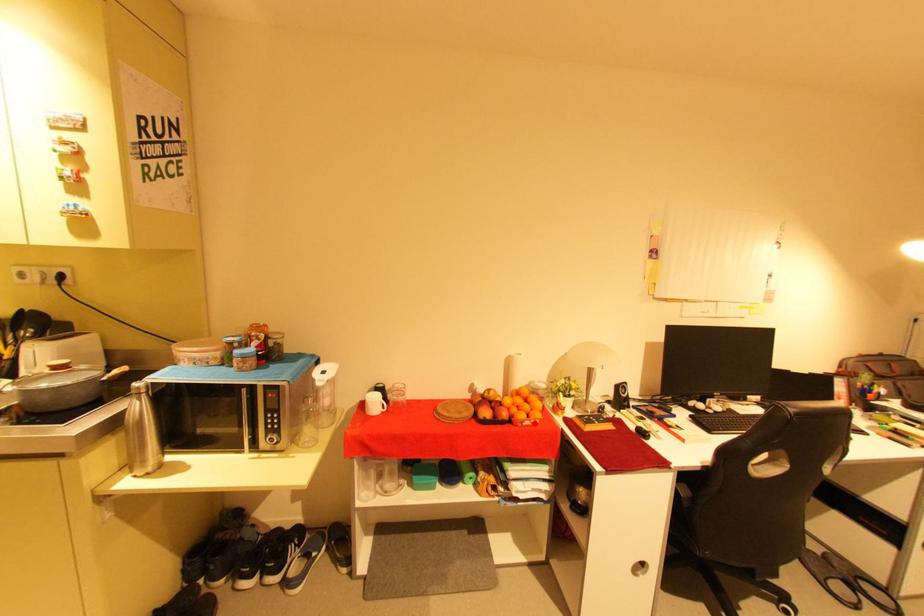
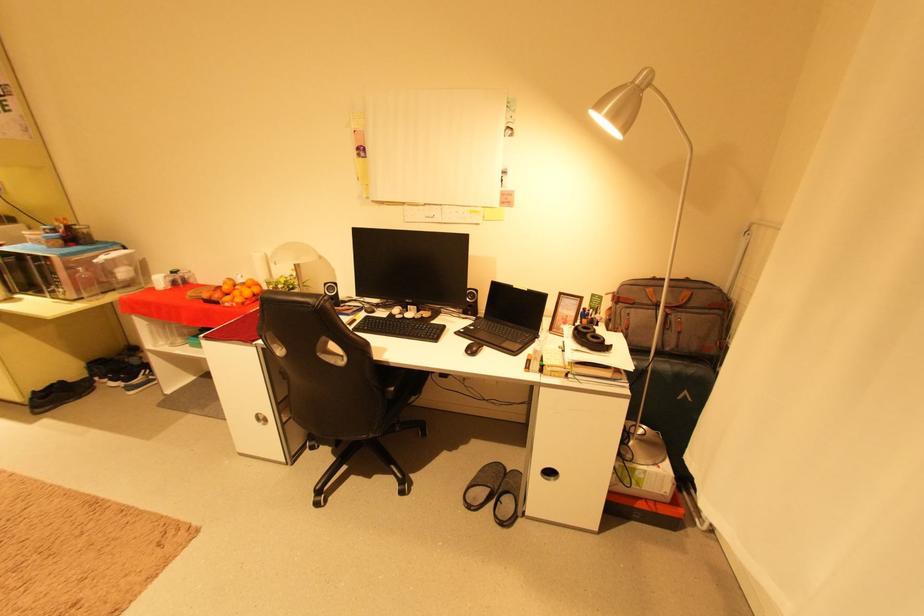
The point at the highlighted location is marked in the first image. Where is the corresponding point in the second image?

(235, 305)